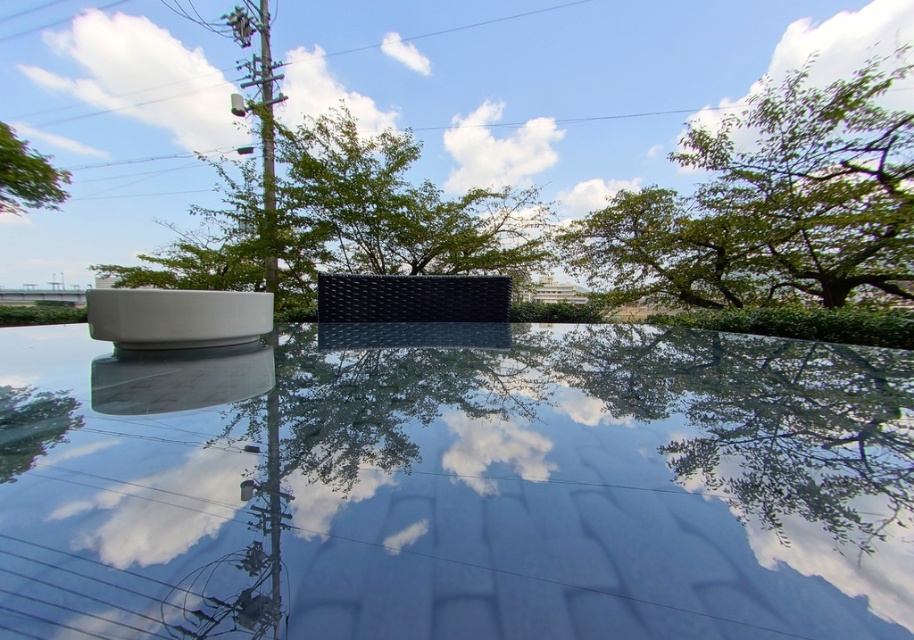
Is the position of glossy reflective puddle at center less distant than that of green leafy tree at upper right?

Yes, glossy reflective puddle at center is in front of green leafy tree at upper right.

Is point (445, 476) positioned before point (711, 234)?

Yes, it is in front of point (711, 234).

Where is `glossy reflective puddle at center`? glossy reflective puddle at center is located at coordinates (457, 488).

You are a GUI agent. You are given a task and a screenshot of the screen. Output one action in this format:
    pyautogui.click(x=<x>, y=<y>)
    Task: Click on the glossy reflective puddle at center
    This screenshot has height=640, width=914.
    Given the screenshot: What is the action you would take?
    pyautogui.click(x=457, y=488)

Does green leafy tree at upper right appear under green leafy tree at upper center?

Correct, green leafy tree at upper right is located below green leafy tree at upper center.

Which is behind, point (721, 136) or point (186, 244)?

Positioned behind is point (186, 244).

Is point (763, 288) positioned behind point (236, 276)?

No, it is not.

This screenshot has height=640, width=914. Identify the location of green leafy tree at upper right. (771, 204).

Does green leafy tree at upper right lie behind green leafy tree at upper left?

No.

Does green leafy tree at upper right appear over green leafy tree at upper left?

Actually, green leafy tree at upper right is below green leafy tree at upper left.

You are a GUI agent. You are given a task and a screenshot of the screen. Output one action in this format:
    pyautogui.click(x=<x>, y=<y>)
    Task: Click on the green leafy tree at upper right
    The height and width of the screenshot is (640, 914).
    Given the screenshot: What is the action you would take?
    771,204